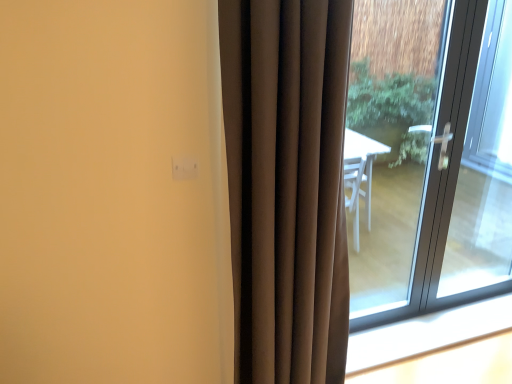
Question: Considering the positions of clear glass door at right and transparent glass door at right in the image, is clear glass door at right taller or shorter than transparent glass door at right?

Choices:
 (A) short
 (B) tall

Answer: (A)

Question: In terms of width, does clear glass door at right look wider or thinner when compared to transparent glass door at right?

Choices:
 (A) thin
 (B) wide

Answer: (A)

Question: Which is nearer to the transparent glass door at right?

Choices:
 (A) white plastic window sill at lower right
 (B) clear glass door at right
 (C) brown velvet curtain at center

Answer: (B)

Question: Estimate the real-world distances between objects in this image. Which object is farther from the white plastic window sill at lower right?

Choices:
 (A) transparent glass door at right
 (B) clear glass door at right
 (C) brown velvet curtain at center

Answer: (C)